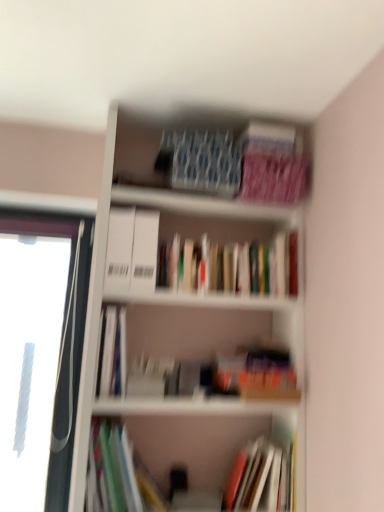
Question: Is white plastic window frame at left not near multicolored paper at lower left, the 3th book when ordered from top to bottom?

Choices:
 (A) no
 (B) yes

Answer: (A)

Question: Does white plastic window frame at left have a smaller size compared to multicolored paper at lower left, the 3th book when ordered from top to bottom?

Choices:
 (A) no
 (B) yes

Answer: (A)

Question: Does white plastic window frame at left lie behind multicolored paper at lower left, which appears as the second book when ordered from the bottom?

Choices:
 (A) no
 (B) yes

Answer: (B)

Question: Is white plastic window frame at left positioned before multicolored paper at lower left, the 3th book when ordered from top to bottom?

Choices:
 (A) yes
 (B) no

Answer: (B)

Question: From a real-world perspective, does white plastic window frame at left sit lower than multicolored paper at lower left, the 3th book when ordered from top to bottom?

Choices:
 (A) yes
 (B) no

Answer: (B)

Question: Based on their sizes in the image, would you say hardcover book at center, the 1th book positioned from the bottom, is bigger or smaller than hardcover books at center, the fourth book ordered from the bottom?

Choices:
 (A) big
 (B) small

Answer: (B)

Question: Looking at their shapes, would you say hardcover book at center, positioned as the fourth book in top-to-bottom order, is wider or thinner than hardcover books at center, the fourth book ordered from the bottom?

Choices:
 (A) wide
 (B) thin

Answer: (A)

Question: Is hardcover book at center, positioned as the fourth book in top-to-bottom order, in front of or behind hardcover books at center, the fourth book ordered from the bottom, in the image?

Choices:
 (A) front
 (B) behind

Answer: (A)

Question: From the image's perspective, is hardcover book at center, positioned as the fourth book in top-to-bottom order, located above or below hardcover books at center, the fourth book ordered from the bottom?

Choices:
 (A) above
 (B) below

Answer: (B)

Question: In terms of width, does hardcover book at center, the 2th book when ordered from top to bottom, look wider or thinner when compared to hardcover books at center, the fourth book ordered from the bottom?

Choices:
 (A) thin
 (B) wide

Answer: (B)

Question: Is hardcover book at center, the 2th book when ordered from top to bottom, taller or shorter than hardcover books at center, the fourth book ordered from the bottom?

Choices:
 (A) short
 (B) tall

Answer: (B)

Question: From a real-world perspective, is hardcover book at center, the 2th book when ordered from top to bottom, physically located above or below hardcover books at center, the fourth book ordered from the bottom?

Choices:
 (A) above
 (B) below

Answer: (B)

Question: Would you say hardcover book at center, the 2th book when ordered from top to bottom, is to the left or to the right of hardcover books at center, which is the 1th book in top-to-bottom order, in the picture?

Choices:
 (A) left
 (B) right

Answer: (A)

Question: From a real-world perspective, is hardcover books at center, the fourth book ordered from the bottom, above or below multicolored paper at lower left, which appears as the second book when ordered from the bottom?

Choices:
 (A) above
 (B) below

Answer: (A)

Question: Is hardcover books at center, which is the 1th book in top-to-bottom order, situated inside multicolored paper at lower left, the 3th book when ordered from top to bottom, or outside?

Choices:
 (A) outside
 (B) inside

Answer: (A)